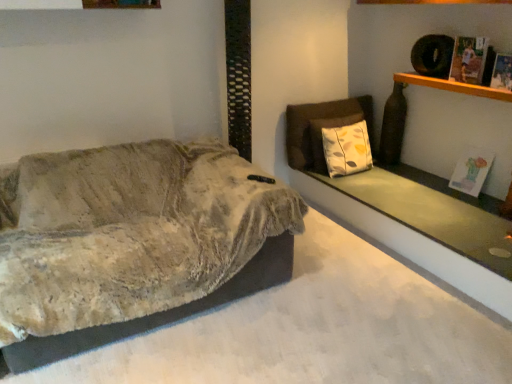
Question: From a real-world perspective, is printed paper magazine at upper right, arranged as the second magazine when viewed from the back, below wooden shelf at upper right?

Choices:
 (A) yes
 (B) no

Answer: (B)

Question: Is printed paper magazine at upper right, which ranks as the 1th magazine in top-to-bottom order, positioned behind wooden shelf at upper right?

Choices:
 (A) yes
 (B) no

Answer: (A)

Question: Is printed paper magazine at upper right, which ranks as the 1th magazine in top-to-bottom order, bigger than wooden shelf at upper right?

Choices:
 (A) yes
 (B) no

Answer: (B)

Question: Does printed paper magazine at upper right, arranged as the second magazine when viewed from the back, have a lesser width compared to wooden shelf at upper right?

Choices:
 (A) no
 (B) yes

Answer: (B)

Question: Is printed paper magazine at upper right, placed as the 3th magazine when sorted from bottom to top, completely or partially outside of wooden shelf at upper right?

Choices:
 (A) no
 (B) yes

Answer: (B)

Question: In the image, is printed paper magazine at upper right, which is the third magazine in back-to-front order, on the left side or the right side of printed paper magazine at upper right, arranged as the second magazine when viewed from the back?

Choices:
 (A) right
 (B) left

Answer: (A)

Question: From a real-world perspective, relative to printed paper magazine at upper right, placed as the 3th magazine when sorted from bottom to top, is printed paper magazine at upper right, the 1th magazine from the front, vertically above or below?

Choices:
 (A) below
 (B) above

Answer: (A)

Question: Considering the positions of point (493, 79) and point (467, 66), is point (493, 79) closer or farther from the camera than point (467, 66)?

Choices:
 (A) farther
 (B) closer

Answer: (B)

Question: Considering the positions of printed paper magazine at upper right, the 1th magazine from the front, and printed paper magazine at upper right, which ranks as the 1th magazine in top-to-bottom order, in the image, is printed paper magazine at upper right, the 1th magazine from the front, taller or shorter than printed paper magazine at upper right, which ranks as the 1th magazine in top-to-bottom order,?

Choices:
 (A) short
 (B) tall

Answer: (A)

Question: Is wooden shelf at upper right situated inside printed paper magazine at upper right, the 2th magazine ordered from the bottom, or outside?

Choices:
 (A) outside
 (B) inside

Answer: (A)

Question: From the image's perspective, is wooden shelf at upper right positioned above or below printed paper magazine at upper right, positioned as the second magazine in top-to-bottom order?

Choices:
 (A) below
 (B) above

Answer: (A)

Question: In terms of size, does wooden shelf at upper right appear bigger or smaller than printed paper magazine at upper right, positioned as the second magazine in top-to-bottom order?

Choices:
 (A) big
 (B) small

Answer: (A)

Question: Considering their positions, is wooden shelf at upper right located in front of or behind printed paper magazine at upper right, the 2th magazine ordered from the bottom?

Choices:
 (A) behind
 (B) front

Answer: (A)

Question: From the image's perspective, is printed paper magazine at upper right, arranged as the second magazine when viewed from the back, positioned above or below textured beige blanket at left?

Choices:
 (A) above
 (B) below

Answer: (A)

Question: In terms of size, does printed paper magazine at upper right, arranged as the 2th magazine when viewed from the front, appear bigger or smaller than textured beige blanket at left?

Choices:
 (A) big
 (B) small

Answer: (B)